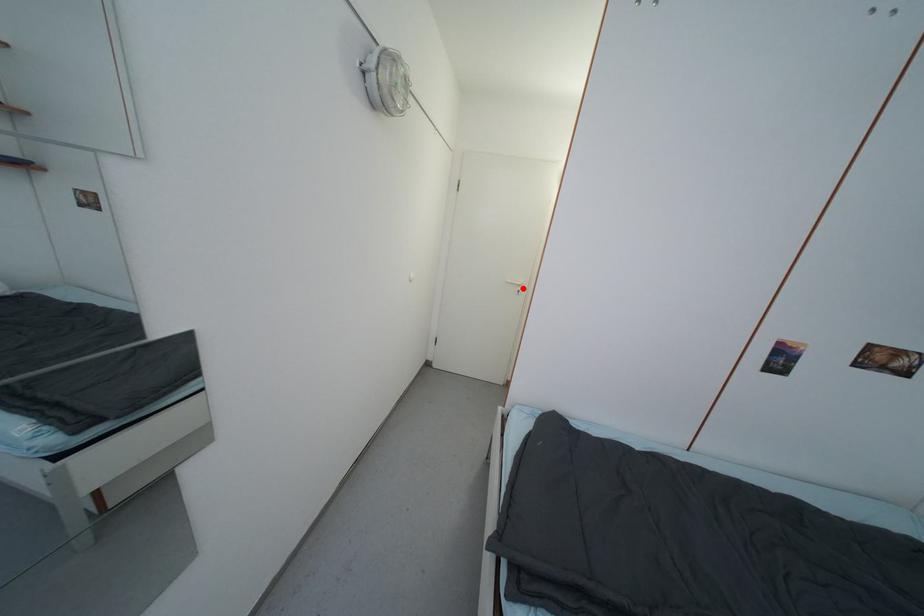
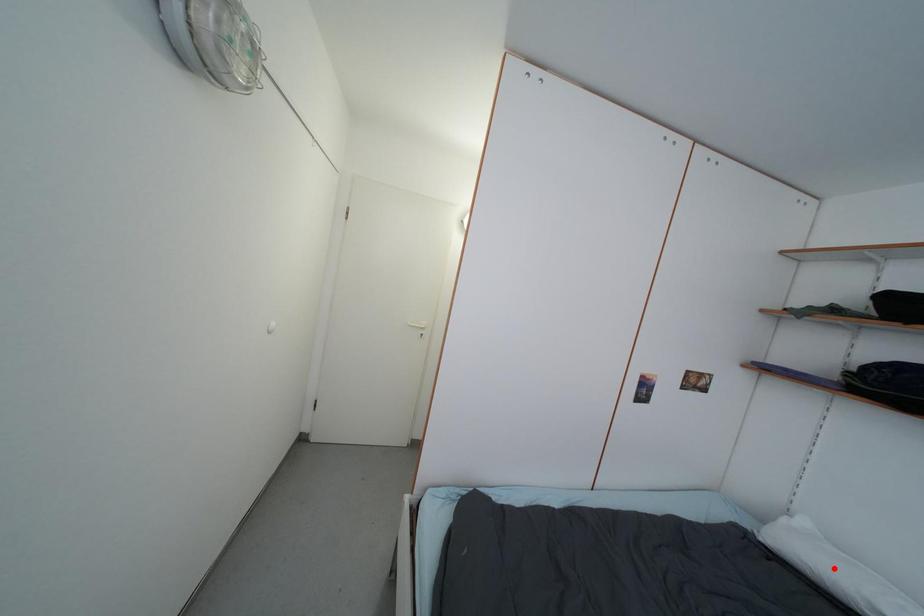
I am providing you with two images of the same scene from different viewpoints. A red point is marked on the first image and another point is marked on the second image. Do the highlighted points in image1 and image2 indicate the same real-world spot?

No